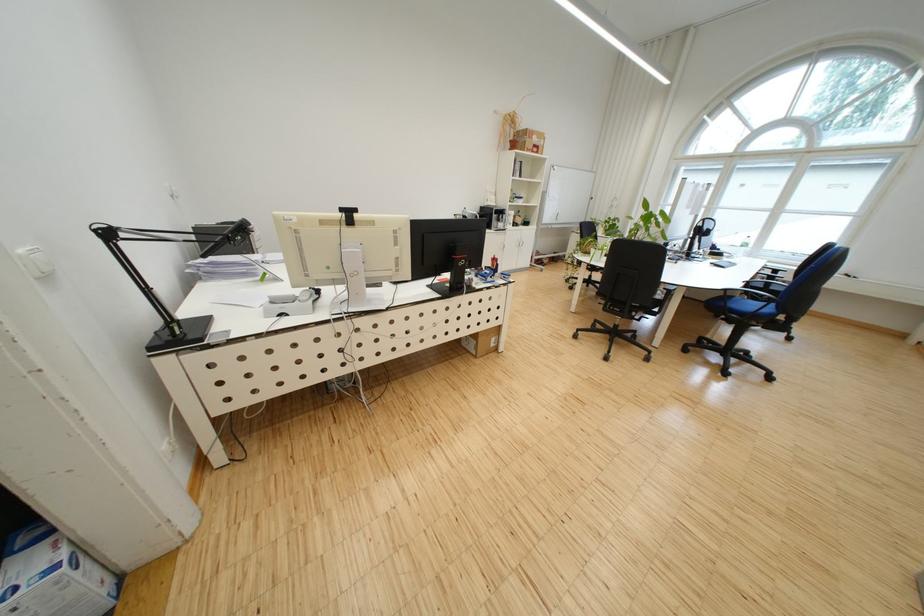
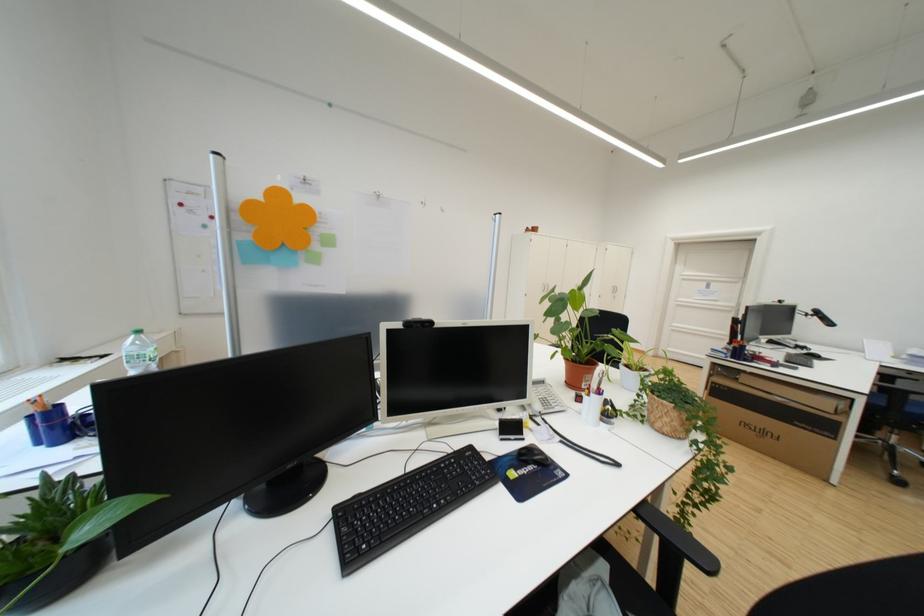
Question: I am providing you with two images of the same scene from different viewpoints. Please identify which objects are invisible in image2.

Choices:
 (A) wicker plant pot
 (B) blue chair armrest
 (C) plastic water bottle
 (D) silver drain knob

Answer: (B)